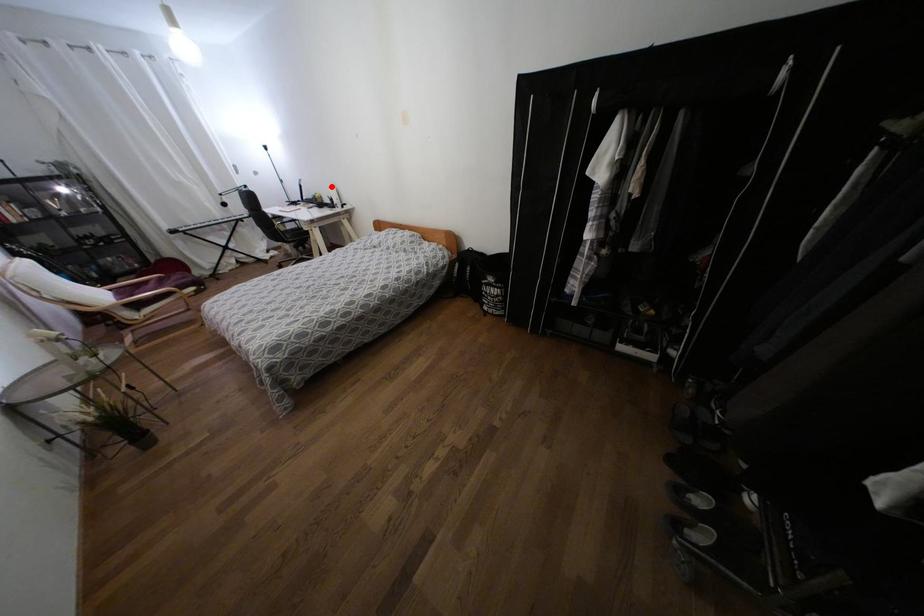
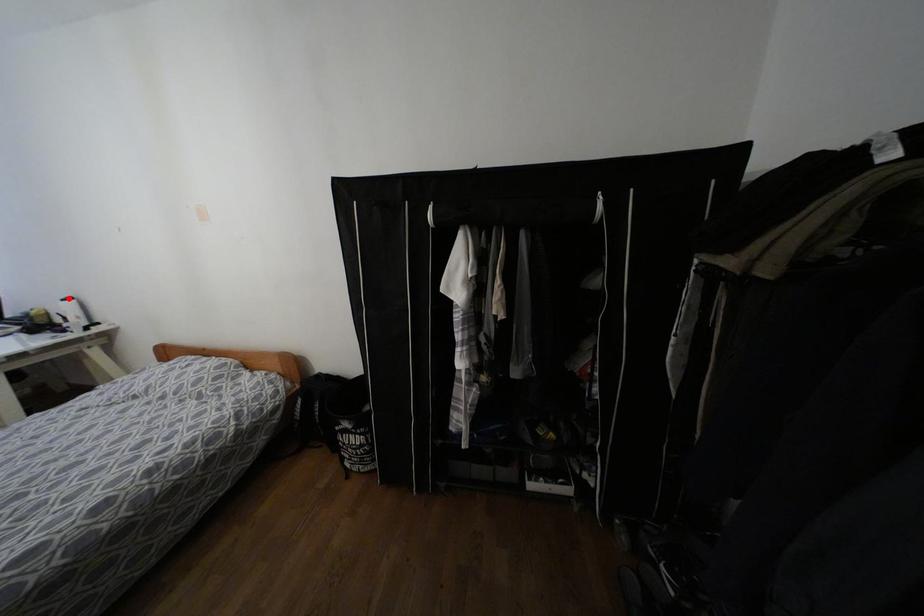
I am providing you with two images of the same scene from different viewpoints. A red point is marked on the first image and another point is marked on the second image. Does the point marked in image1 correspond to the same location as the one in image2?

Yes